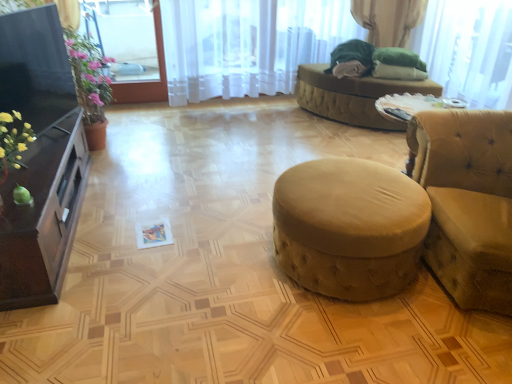
Question: From the image's perspective, is translucent fabric at upper right, which is the second window screen from left to right, on beige fabric ottoman at center?

Choices:
 (A) no
 (B) yes

Answer: (B)

Question: Is translucent fabric at upper right, arranged as the 1th window screen when viewed from the right, turned away from beige fabric ottoman at center?

Choices:
 (A) yes
 (B) no

Answer: (B)

Question: Is translucent fabric at upper right, arranged as the 1th window screen when viewed from the right, shorter than beige fabric ottoman at center?

Choices:
 (A) yes
 (B) no

Answer: (B)

Question: Is translucent fabric at upper right, which is the second window screen from left to right, placed right next to beige fabric ottoman at center?

Choices:
 (A) yes
 (B) no

Answer: (B)

Question: Is translucent fabric at upper right, which is the second window screen from left to right, behind beige fabric ottoman at center?

Choices:
 (A) no
 (B) yes

Answer: (A)

Question: Would you say translucent fabric at upper right, which is the second window screen from left to right, contains beige fabric ottoman at center?

Choices:
 (A) no
 (B) yes

Answer: (A)

Question: Does velvet yellow studio couch at right have a larger size compared to green fabric at upper right?

Choices:
 (A) no
 (B) yes

Answer: (B)

Question: Does velvet yellow studio couch at right have a greater width compared to green fabric at upper right?

Choices:
 (A) yes
 (B) no

Answer: (A)

Question: Considering the relative sizes of velvet yellow studio couch at right and green fabric at upper right in the image provided, is velvet yellow studio couch at right thinner than green fabric at upper right?

Choices:
 (A) no
 (B) yes

Answer: (A)

Question: From a real-world perspective, does velvet yellow studio couch at right sit lower than green fabric at upper right?

Choices:
 (A) yes
 (B) no

Answer: (A)

Question: Is velvet yellow studio couch at right located outside green fabric at upper right?

Choices:
 (A) yes
 (B) no

Answer: (A)

Question: Is velvet yellow studio couch at right taller than green fabric at upper right?

Choices:
 (A) yes
 (B) no

Answer: (A)

Question: Are suede-like beige stool at center and beige fabric ottoman at center located far from each other?

Choices:
 (A) no
 (B) yes

Answer: (B)